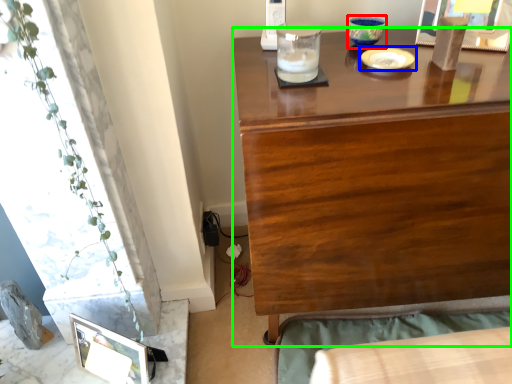
Question: Based on their relative distances, which object is farther from candle holder (highlighted by a red box)? Choose from tableware (highlighted by a blue box) and desk (highlighted by a green box).

Choices:
 (A) tableware
 (B) desk

Answer: (B)